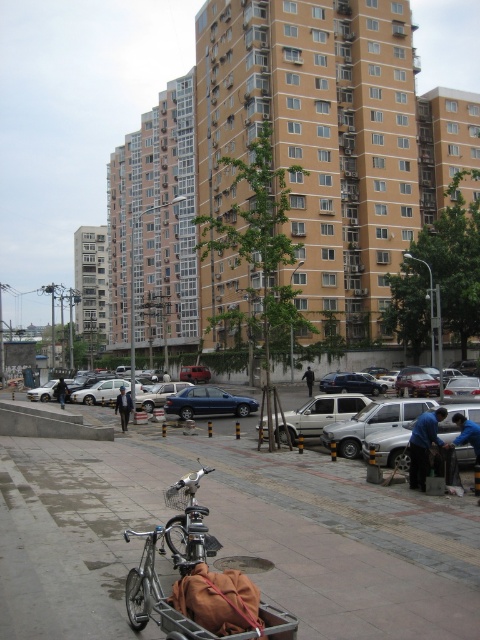
Between silver metallic sedan at center and dark blue fabric at center, which one is positioned higher?

silver metallic sedan at center is higher up.

Who is positioned more to the right, silver metallic sedan at center or dark blue fabric at center?

Positioned to the right is dark blue fabric at center.

Which is behind, point (168, 387) or point (310, 388)?

Point (310, 388)

The image size is (480, 640). I want to click on silver metallic sedan at center, so click(395, 444).

This screenshot has height=640, width=480. In order to click on silver metallic bicycle at center in this screenshot , I will do `click(168, 548)`.

Does silver metallic bicycle at center have a greater width compared to silver metallic sedan at center?

Incorrect, silver metallic bicycle at center's width does not surpass silver metallic sedan at center's.

You are a GUI agent. You are given a task and a screenshot of the screen. Output one action in this format:
    pyautogui.click(x=<x>, y=<y>)
    Task: Click on the silver metallic bicycle at center
    The image size is (480, 640).
    Given the screenshot: What is the action you would take?
    pyautogui.click(x=168, y=548)

Identify the location of silver metallic bicycle at center. This screenshot has width=480, height=640. (168, 548).

Who is shorter, silver metallic bicycle at center or black leather jacket at lower left?

Standing shorter between the two is silver metallic bicycle at center.

Which is in front, point (154, 568) or point (59, 401)?

Point (154, 568)

This screenshot has height=640, width=480. I want to click on silver metallic bicycle at center, so click(x=168, y=548).